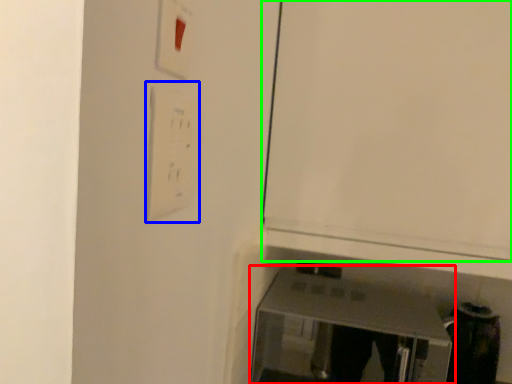
Question: Based on their relative distances, which object is nearer to furniture (highlighted by a red box)? Choose from light switch (highlighted by a blue box) and door (highlighted by a green box).

Choices:
 (A) light switch
 (B) door

Answer: (B)